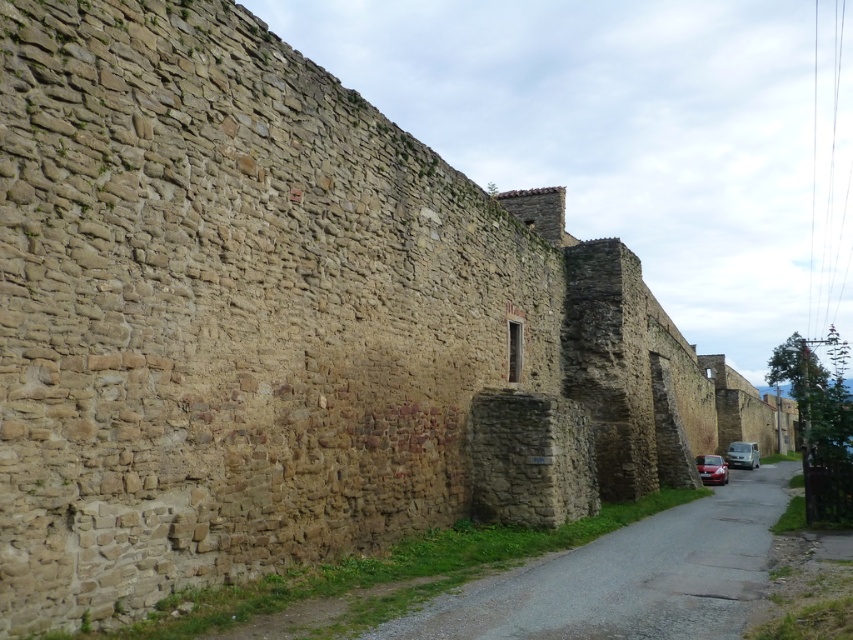
You are standing in front of an old stone wall and notice two points marked on it. One is at coordinate point (514, 595) and the other at point (703, 468). Which point is nearer to you?

Point (514, 595) is closer to the viewer than point (703, 468).